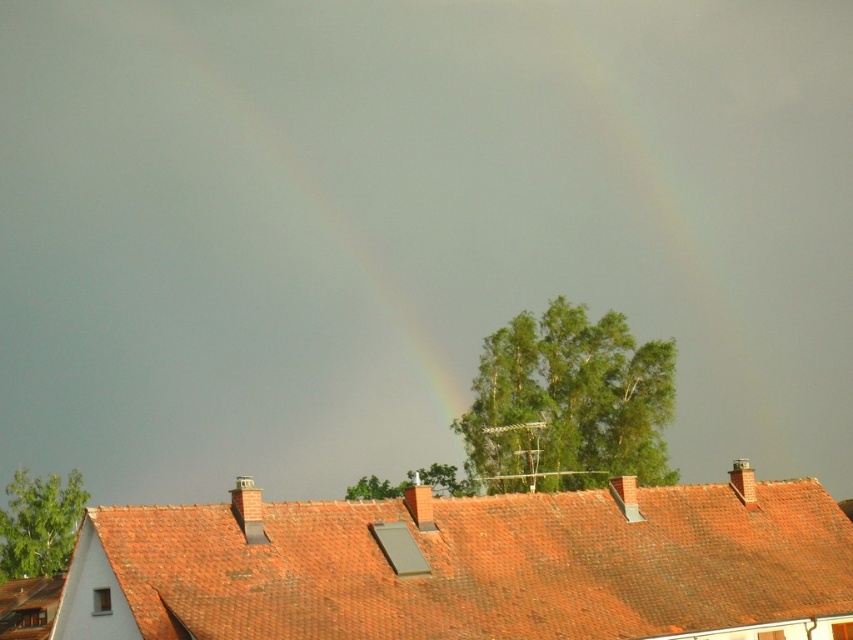
Can you confirm if red tile roof at center is positioned above rainbow at upper center?

No.

This screenshot has height=640, width=853. Describe the element at coordinates (469, 566) in the screenshot. I see `red tile roof at center` at that location.

Locate an element on the screen. Image resolution: width=853 pixels, height=640 pixels. red tile roof at center is located at coordinates (469, 566).